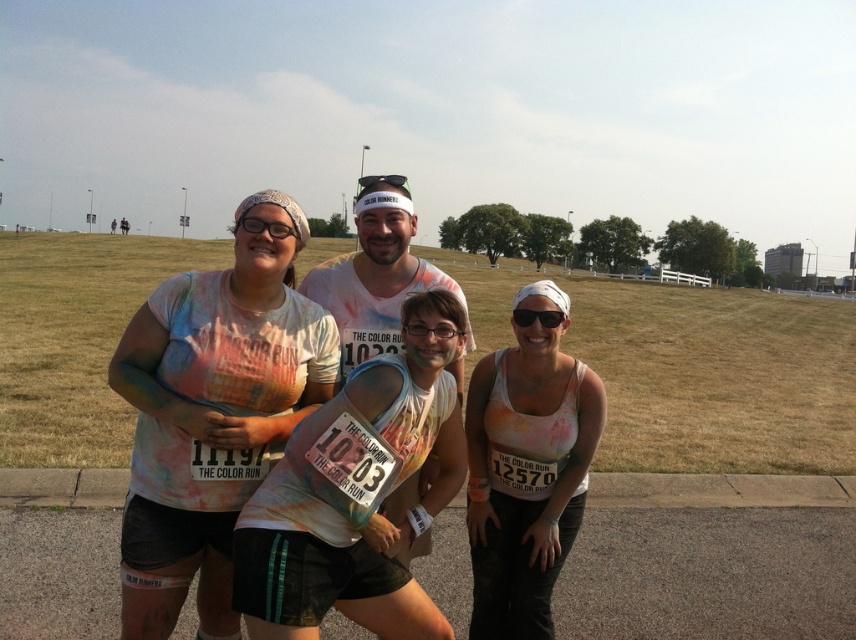
You are a photographer at the Color Run event. You need to capture a photo of the multicolored fabric shirt at center and the painted cotton shirt at center. Which shirt will appear taller in the photo?

The multicolored fabric shirt at center will appear taller in the photo because it has a greater height compared to the painted cotton shirt at center.

You are a photographer at The Color Run event. You need to capture a photo of both the matte white tank top at center and the painted cotton shirt at center. Which clothing item will appear smaller in the photo?

The matte white tank top at center has a smaller size compared to the painted cotton shirt at center, so it will appear smaller in the photo.